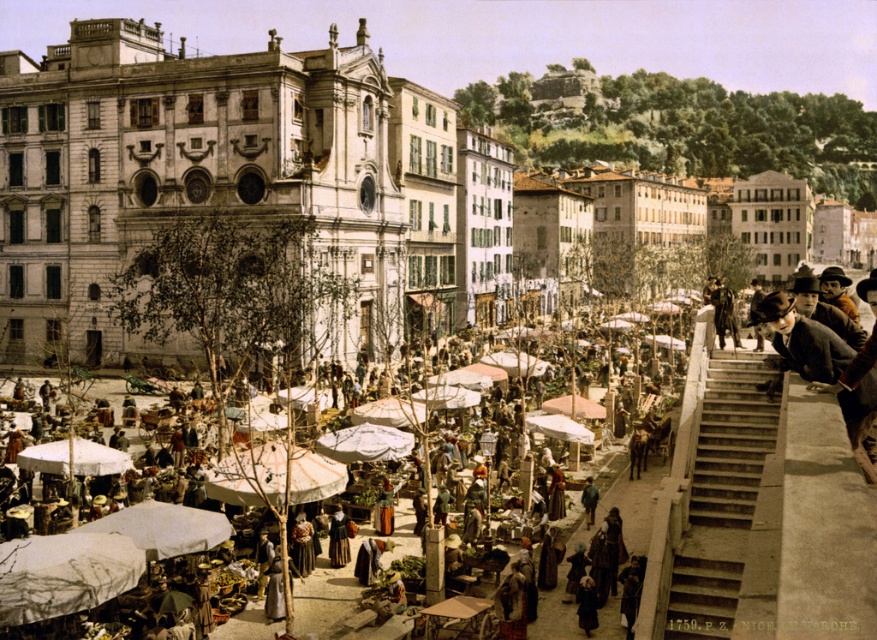
The width and height of the screenshot is (877, 640). What do you see at coordinates (722, 496) in the screenshot?
I see `gray concrete stairs at right` at bounding box center [722, 496].

Who is more forward, (702, 618) or (729, 316)?

Point (702, 618) is more forward.

Where is `gray concrete stairs at right`? gray concrete stairs at right is located at coordinates (722, 496).

Does point (800, 438) come in front of point (733, 472)?

That is True.

Can you confirm if white fabric umbrella at lower left is wider than gray concrete stairs at right?

Yes, white fabric umbrella at lower left is wider than gray concrete stairs at right.

I want to click on white fabric umbrella at lower left, so click(783, 532).

Which is more to the right, white fabric umbrella at lower left or dark brown fur coat at upper right?

dark brown fur coat at upper right is more to the right.

Which is behind, point (845, 552) or point (719, 288)?

Point (719, 288)

Where is `white fabric umbrella at lower left`? white fabric umbrella at lower left is located at coordinates (783, 532).